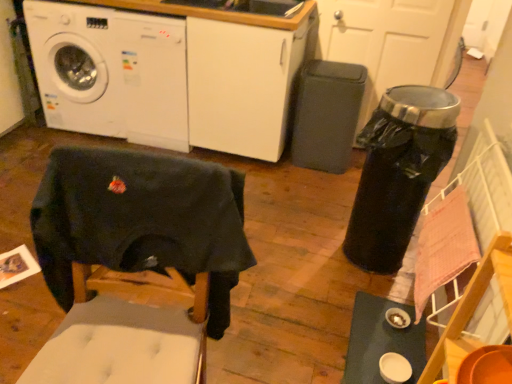
Question: Are dark fabric swivel chair at lower left and white glossy table at lower right making contact?

Choices:
 (A) no
 (B) yes

Answer: (A)

Question: Does dark fabric swivel chair at lower left appear on the left side of white glossy table at lower right?

Choices:
 (A) no
 (B) yes

Answer: (B)

Question: From a real-world perspective, is dark fabric swivel chair at lower left positioned under white glossy table at lower right based on gravity?

Choices:
 (A) no
 (B) yes

Answer: (A)

Question: Is dark fabric swivel chair at lower left oriented away from white glossy table at lower right?

Choices:
 (A) yes
 (B) no

Answer: (B)

Question: Is dark fabric swivel chair at lower left smaller than white glossy table at lower right?

Choices:
 (A) no
 (B) yes

Answer: (A)

Question: From a real-world perspective, is dark fabric swivel chair at lower left physically located above or below white glossy table at lower right?

Choices:
 (A) below
 (B) above

Answer: (B)

Question: Is point (204, 228) closer or farther from the camera than point (353, 367)?

Choices:
 (A) farther
 (B) closer

Answer: (B)

Question: Is dark fabric swivel chair at lower left taller or shorter than white glossy table at lower right?

Choices:
 (A) tall
 (B) short

Answer: (A)

Question: Looking at their shapes, would you say dark fabric swivel chair at lower left is wider or thinner than white glossy table at lower right?

Choices:
 (A) thin
 (B) wide

Answer: (A)

Question: In terms of width, does dark fabric swivel chair at lower left look wider or thinner when compared to white glossy washing machine at upper left, the 1th washing machine when ordered from left to right?

Choices:
 (A) wide
 (B) thin

Answer: (B)

Question: In terms of height, does dark fabric swivel chair at lower left look taller or shorter compared to white glossy washing machine at upper left, the 1th washing machine when ordered from left to right?

Choices:
 (A) short
 (B) tall

Answer: (A)

Question: Relative to white glossy washing machine at upper left, which is the 2th washing machine in right-to-left order, is dark fabric swivel chair at lower left in front or behind?

Choices:
 (A) behind
 (B) front

Answer: (B)

Question: Is dark fabric swivel chair at lower left inside or outside of white glossy washing machine at upper left, the 1th washing machine when ordered from left to right?

Choices:
 (A) inside
 (B) outside

Answer: (B)

Question: Visually, is white glossy washing machine at upper left, which is the 2th washing machine in right-to-left order, positioned to the left or to the right of white glossy washing machine at upper left, marked as the first washing machine in a right-to-left arrangement?

Choices:
 (A) right
 (B) left

Answer: (B)

Question: Is white glossy washing machine at upper left, the 1th washing machine when ordered from left to right, inside the boundaries of white glossy washing machine at upper left, the second washing machine in the left-to-right sequence, or outside?

Choices:
 (A) inside
 (B) outside

Answer: (B)